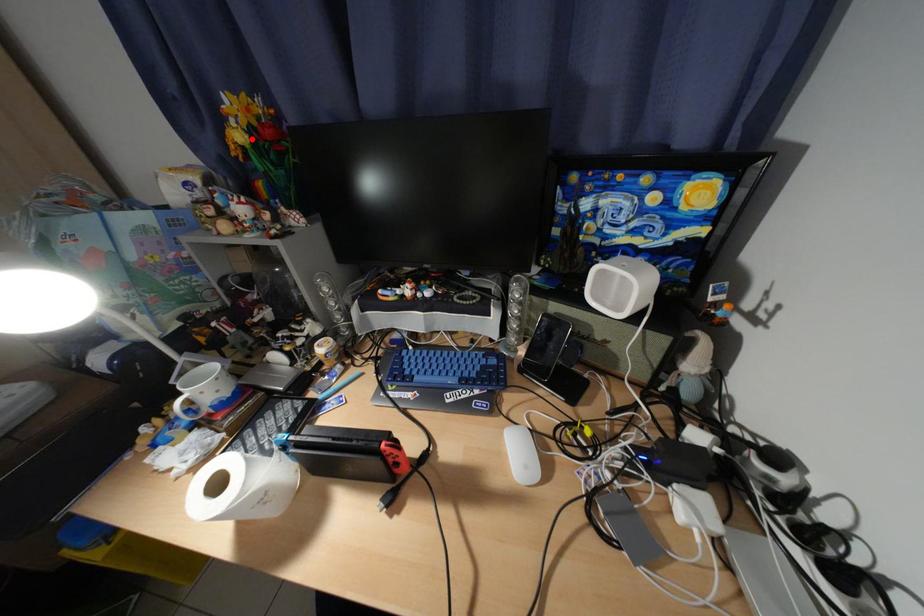
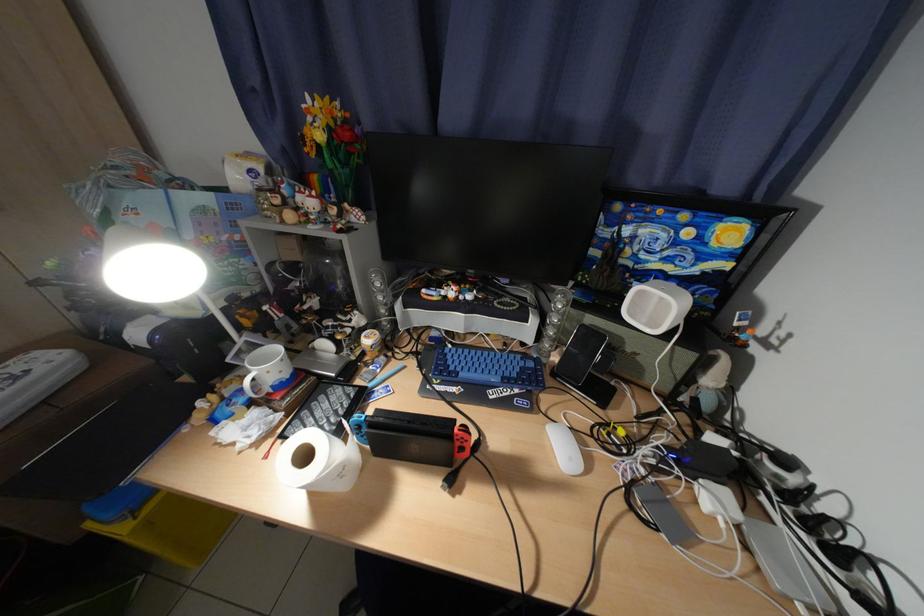
Where in the second image is the point corresponding to the highlighted location from the first image?

(331, 138)